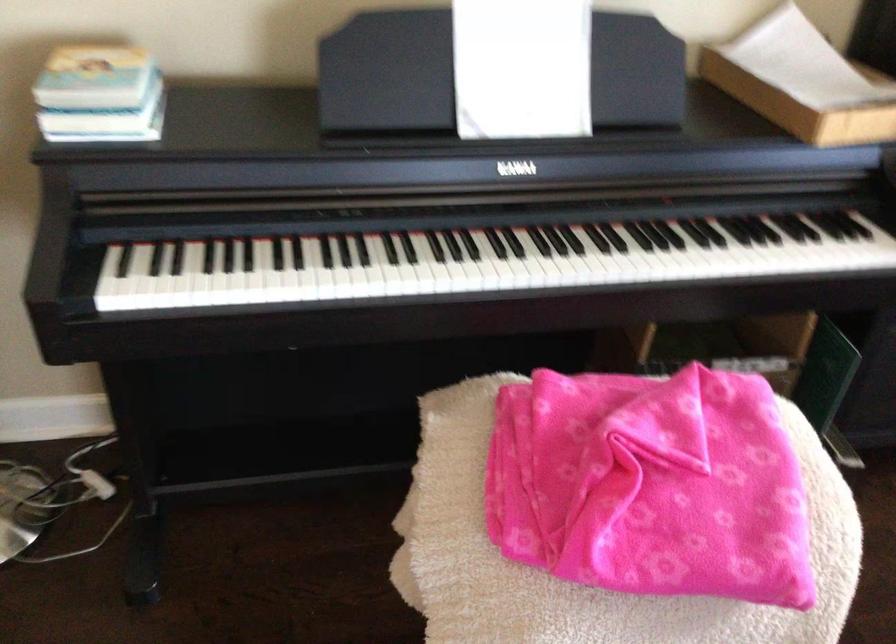
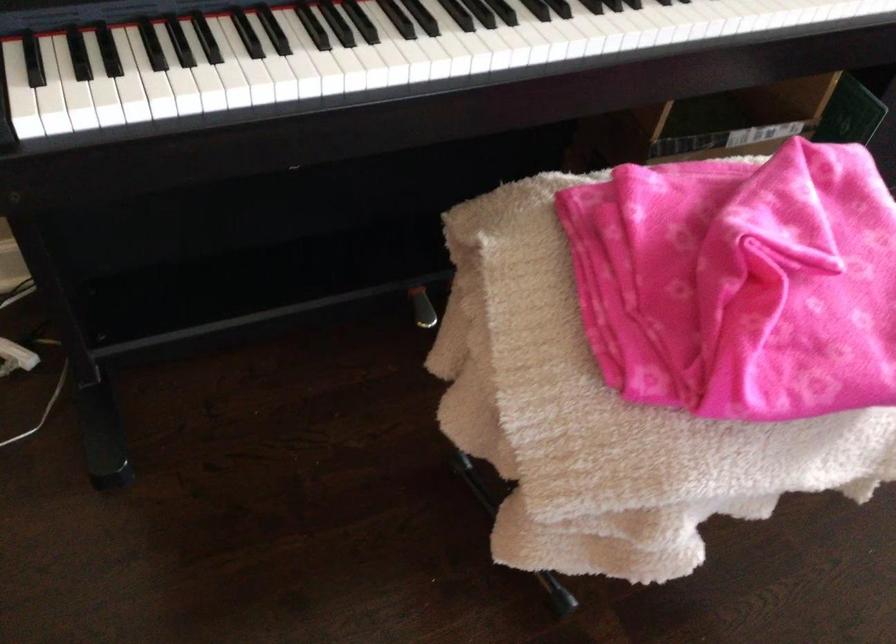
Find the pixel in the second image that matches point 609,473 in the first image.

(739, 283)